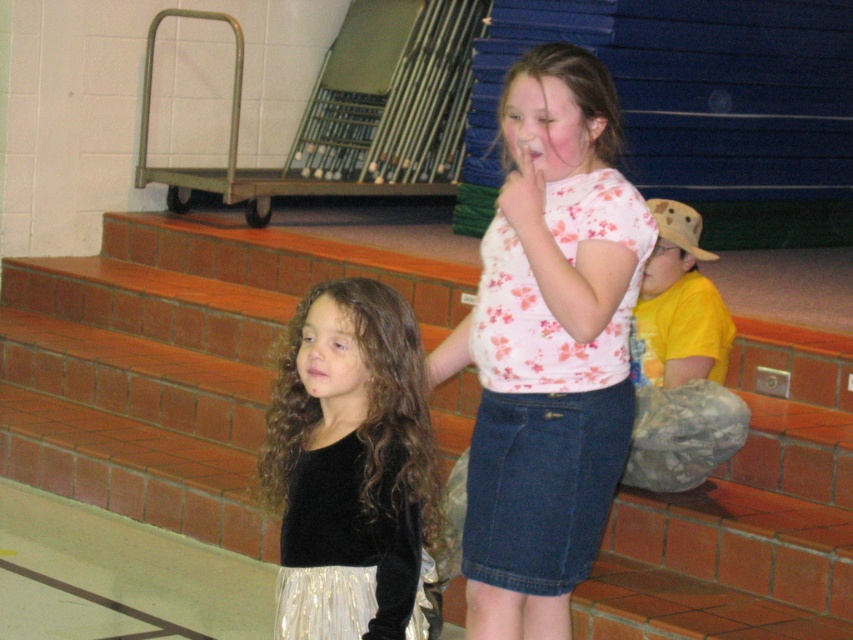
Question: Which point is farther to the camera?

Choices:
 (A) floral cotton shirt at center
 (B) yellow cotton shirt at right
 (C) black velvet top at center

Answer: (B)

Question: Does brick stairs at center come in front of yellow cotton shirt at right?

Choices:
 (A) yes
 (B) no

Answer: (B)

Question: Is the position of floral cotton shirt at center less distant than that of black velvet top at center?

Choices:
 (A) no
 (B) yes

Answer: (A)

Question: Among these objects, which one is farthest from the camera?

Choices:
 (A) black velvet top at center
 (B) brick stairs at center
 (C) yellow cotton shirt at right
 (D) floral cotton shirt at center

Answer: (B)

Question: Considering the relative positions of floral cotton shirt at center and yellow cotton shirt at right in the image provided, where is floral cotton shirt at center located with respect to yellow cotton shirt at right?

Choices:
 (A) below
 (B) above

Answer: (A)

Question: Which object is farther from the camera taking this photo?

Choices:
 (A) brick stairs at center
 (B) floral cotton shirt at center

Answer: (A)